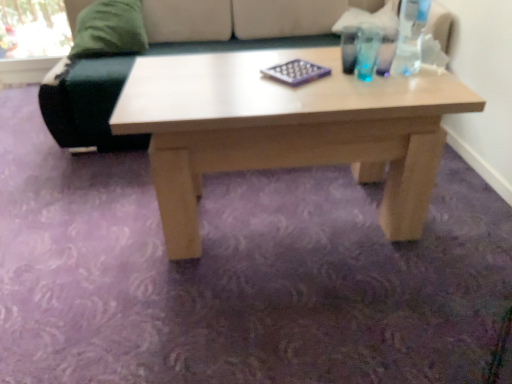
This screenshot has height=384, width=512. Describe the element at coordinates (410, 36) in the screenshot. I see `transparent plastic bottle at upper right` at that location.

What is the approximate height of purple matte chessboard at center?

2.27 inches.

The width and height of the screenshot is (512, 384). Describe the element at coordinates (109, 29) in the screenshot. I see `green fabric pillow at upper left` at that location.

Find the location of a particular element. transparent plastic bottle at upper right is located at coordinates (410, 36).

Is green fabric pillow at upper left at the right side of purple matte chessboard at center?

No, green fabric pillow at upper left is not to the right of purple matte chessboard at center.

Which is nearer, (x=124, y=4) or (x=270, y=72)?

Point (x=124, y=4) appears to be farther away from the viewer than point (x=270, y=72).

Is green fabric pillow at upper left spatially inside purple matte chessboard at center, or outside of it?

green fabric pillow at upper left lies outside purple matte chessboard at center.

From the image's perspective, is velvet green couch at upper left below green fabric pillow at upper left?

Yes, from the image's perspective, velvet green couch at upper left is beneath green fabric pillow at upper left.

Is the position of velvet green couch at upper left less distant than that of green fabric pillow at upper left?

Yes, the depth of velvet green couch at upper left is less than that of green fabric pillow at upper left.

Is point (95, 114) positioned in front of point (105, 42)?

Yes, point (95, 114) is closer to viewer.

Is green fabric pillow at upper left facing away from transparent plastic bottle at upper right?

green fabric pillow at upper left does not have its back to transparent plastic bottle at upper right.

From a real-world perspective, which is physically above, green fabric pillow at upper left or transparent plastic bottle at upper right?

In real-world perspective, transparent plastic bottle at upper right is above.

Is green fabric pillow at upper left smaller than transparent plastic bottle at upper right?

No, green fabric pillow at upper left is not smaller than transparent plastic bottle at upper right.

From the image's perspective, is green fabric pillow at upper left located beneath transparent plastic bottle at upper right?

No, from the image's perspective, green fabric pillow at upper left is not below transparent plastic bottle at upper right.

Who is taller, velvet green couch at upper left or purple matte chessboard at center?

With more height is velvet green couch at upper left.

Which object is further away from the camera taking this photo, velvet green couch at upper left or purple matte chessboard at center?

Positioned behind is velvet green couch at upper left.

From the image's perspective, which one is positioned higher, velvet green couch at upper left or purple matte chessboard at center?

velvet green couch at upper left, from the image's perspective.

Could you tell me if green fabric pillow at upper left is turned towards velvet green couch at upper left?

Yes, green fabric pillow at upper left is facing velvet green couch at upper left.

Can you confirm if green fabric pillow at upper left is thinner than velvet green couch at upper left?

Correct, the width of green fabric pillow at upper left is less than that of velvet green couch at upper left.

How much distance is there between green fabric pillow at upper left and velvet green couch at upper left?

A distance of 26.77 centimeters exists between green fabric pillow at upper left and velvet green couch at upper left.

Which object is more forward, green fabric pillow at upper left or velvet green couch at upper left?

velvet green couch at upper left is closer to the camera.

Find the location of a particular element. This screenshot has width=512, height=384. bottle in front of the velvet green couch at upper left is located at coordinates (410, 36).

Looking at this image, considering the sizes of objects transparent plastic bottle at upper right and velvet green couch at upper left in the image provided, who is bigger, transparent plastic bottle at upper right or velvet green couch at upper left?

Bigger between the two is velvet green couch at upper left.

How different are the orientations of transparent plastic bottle at upper right and velvet green couch at upper left in degrees?

transparent plastic bottle at upper right and velvet green couch at upper left are facing 1.16 degrees away from each other.

From the image's perspective, relative to velvet green couch at upper left, is transparent plastic bottle at upper right above or below?

Clearly, from the image's perspective, transparent plastic bottle at upper right is below velvet green couch at upper left.

How much distance is there between velvet green couch at upper left and transparent plastic bottle at upper right?

1.16 meters.

From the picture: Considering the relative sizes of velvet green couch at upper left and transparent plastic bottle at upper right in the image provided, is velvet green couch at upper left taller than transparent plastic bottle at upper right?

Yes, velvet green couch at upper left is taller than transparent plastic bottle at upper right.

Is velvet green couch at upper left located outside transparent plastic bottle at upper right?

That's correct, velvet green couch at upper left is outside of transparent plastic bottle at upper right.

Between velvet green couch at upper left and transparent plastic bottle at upper right, which one appears on the right side from the viewer's perspective?

transparent plastic bottle at upper right is more to the right.

What are the coordinates of `pad that is in front of the green fabric pillow at upper left` in the screenshot? It's located at (296, 72).

Find the location of a particular element. The image size is (512, 384). pillow above the velvet green couch at upper left (from the image's perspective) is located at coordinates (109, 29).

Which object lies nearer to the anchor point transparent plastic bottle at upper right, purple matte chessboard at center or velvet green couch at upper left?

The object closer to transparent plastic bottle at upper right is purple matte chessboard at center.

Looking at the image, which one is located further to transparent plastic bottle at upper right, green fabric pillow at upper left or velvet green couch at upper left?

The object further to transparent plastic bottle at upper right is green fabric pillow at upper left.

From the image, which object appears to be nearer to transparent plastic bottle at upper right, velvet green couch at upper left or green fabric pillow at upper left?

velvet green couch at upper left.

Considering their positions, is green fabric pillow at upper left positioned closer to velvet green couch at upper left than transparent plastic bottle at upper right?

The object closer to velvet green couch at upper left is green fabric pillow at upper left.

Based on their spatial positions, is velvet green couch at upper left or purple matte chessboard at center closer to transparent plastic bottle at upper right?

Among the two, purple matte chessboard at center is located nearer to transparent plastic bottle at upper right.

Looking at the image, which one is located further to velvet green couch at upper left, purple matte chessboard at center or transparent plastic bottle at upper right?

transparent plastic bottle at upper right lies further to velvet green couch at upper left than the other object.

Looking at the image, which one is located closer to purple matte chessboard at center, transparent plastic bottle at upper right or velvet green couch at upper left?

Based on the image, transparent plastic bottle at upper right appears to be nearer to purple matte chessboard at center.

From the image, which object appears to be nearer to green fabric pillow at upper left, velvet green couch at upper left or purple matte chessboard at center?

The object closer to green fabric pillow at upper left is velvet green couch at upper left.

Locate an element on the screen. studio couch situated between green fabric pillow at upper left and transparent plastic bottle at upper right from left to right is located at coordinates (87, 103).

Locate an element on the screen. The image size is (512, 384). pad between velvet green couch at upper left and transparent plastic bottle at upper right in the horizontal direction is located at coordinates (296, 72).

Find the location of a particular element. pad situated between green fabric pillow at upper left and transparent plastic bottle at upper right from left to right is located at coordinates (296, 72).

The image size is (512, 384). Find the location of `studio couch situated between green fabric pillow at upper left and purple matte chessboard at center from left to right`. studio couch situated between green fabric pillow at upper left and purple matte chessboard at center from left to right is located at coordinates (87, 103).